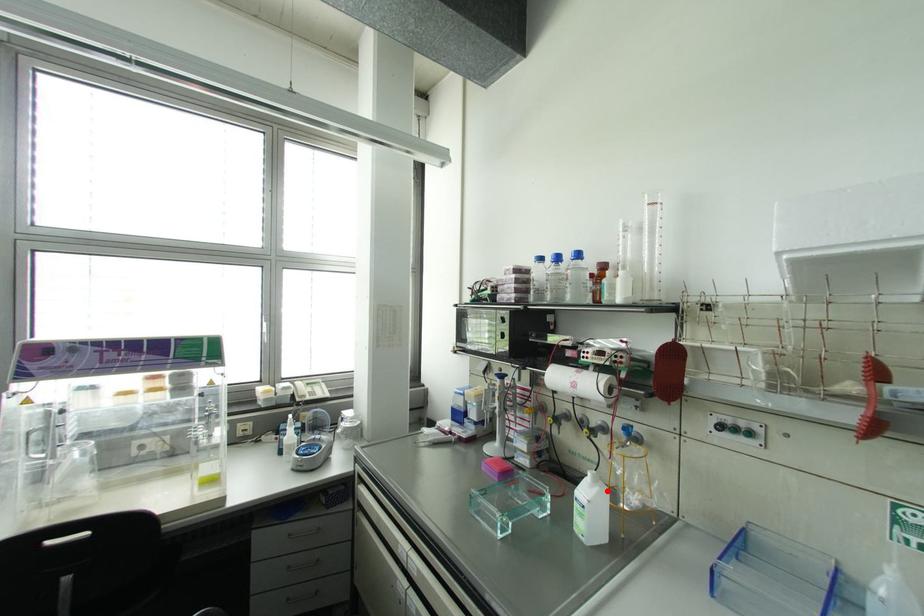
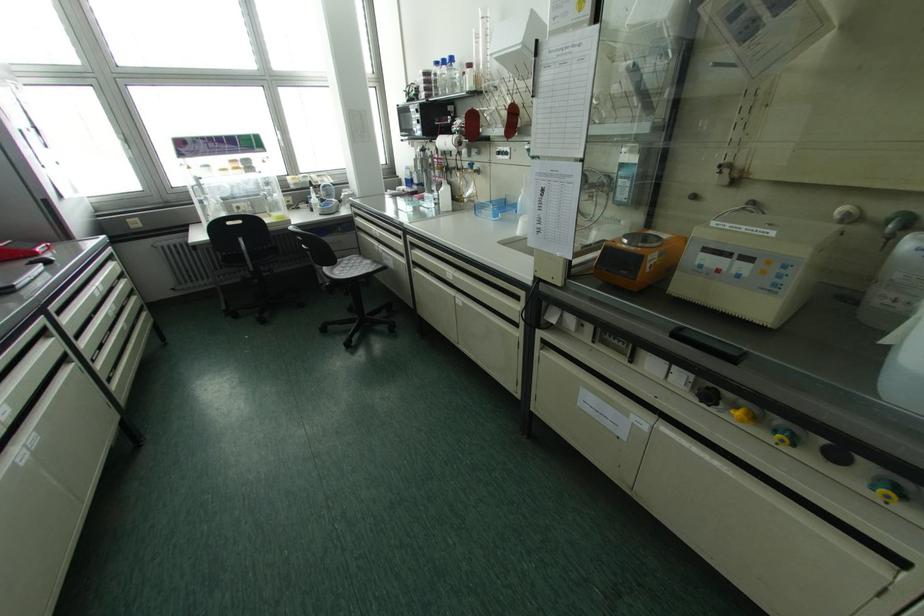
The point at the highlighted location is marked in the first image. Where is the corresponding point in the second image?

(448, 187)